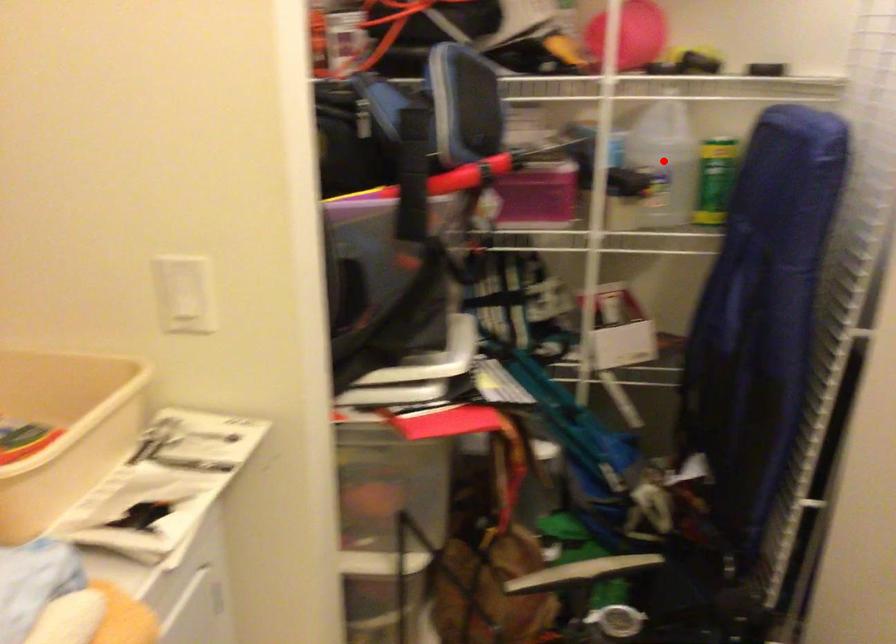
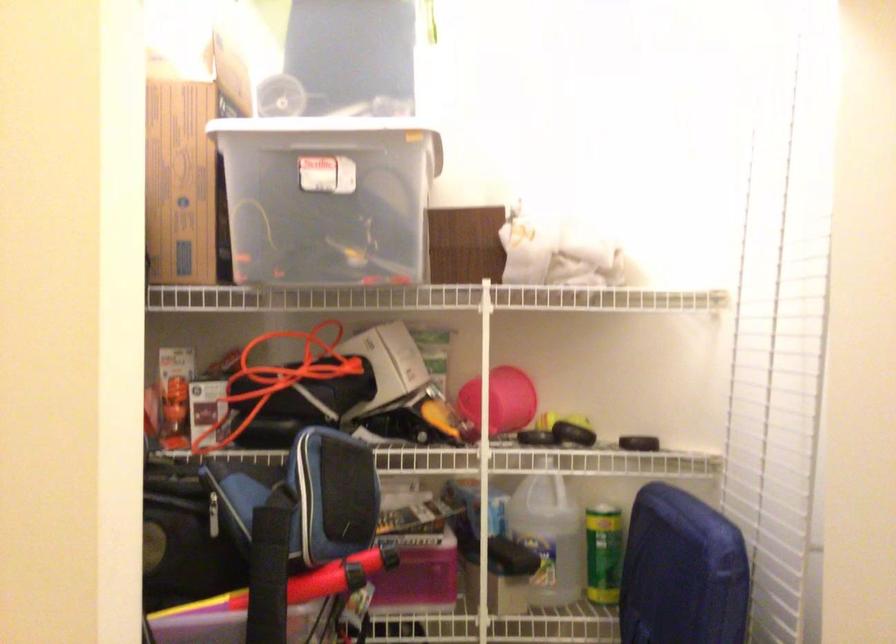
The point at the highlighted location is marked in the first image. Where is the corresponding point in the second image?

(548, 536)